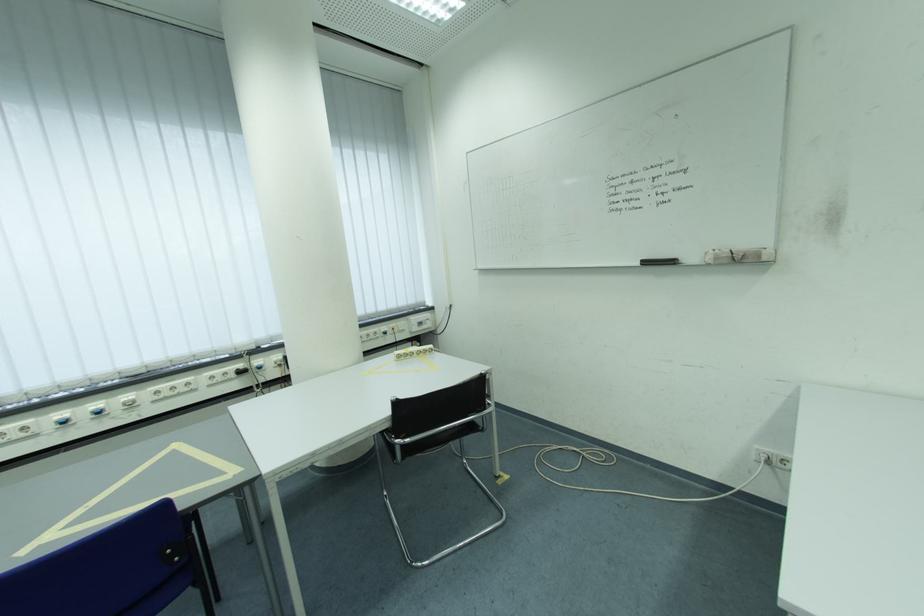
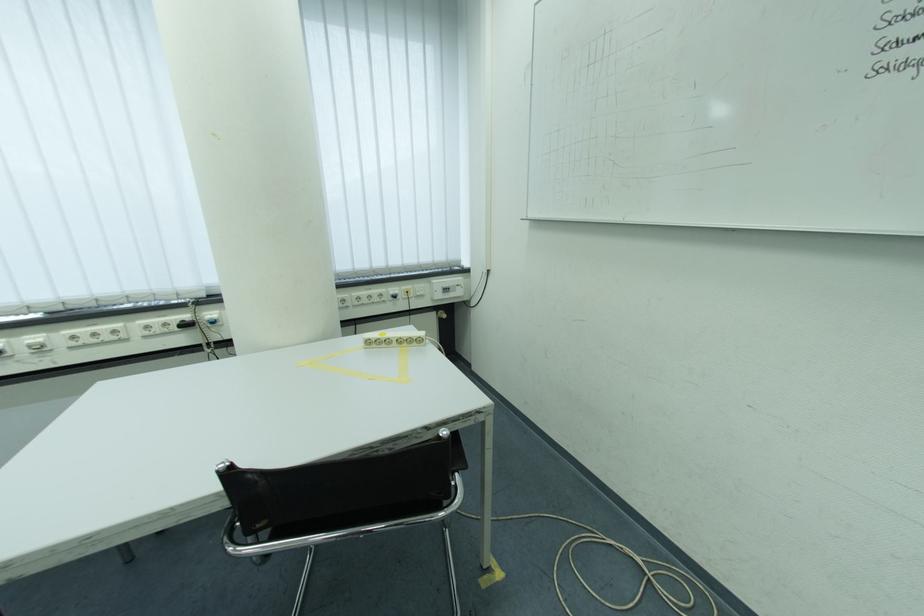
Where in the second image is the point corresponding to the point at 269,370 from the first image?

(223, 325)